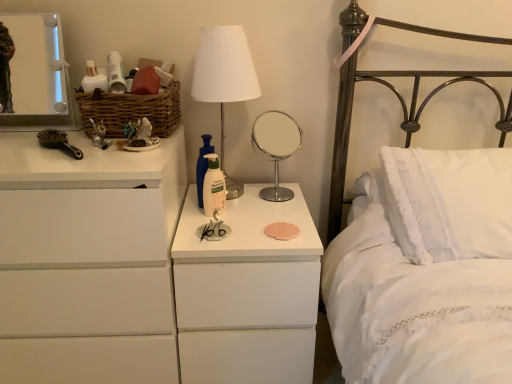
The height and width of the screenshot is (384, 512). In order to click on free area in between chrome/metallic round mirror at center, which is counted as the 2th mirror, starting from the top, and white matte lotion at center in this screenshot , I will do `click(250, 206)`.